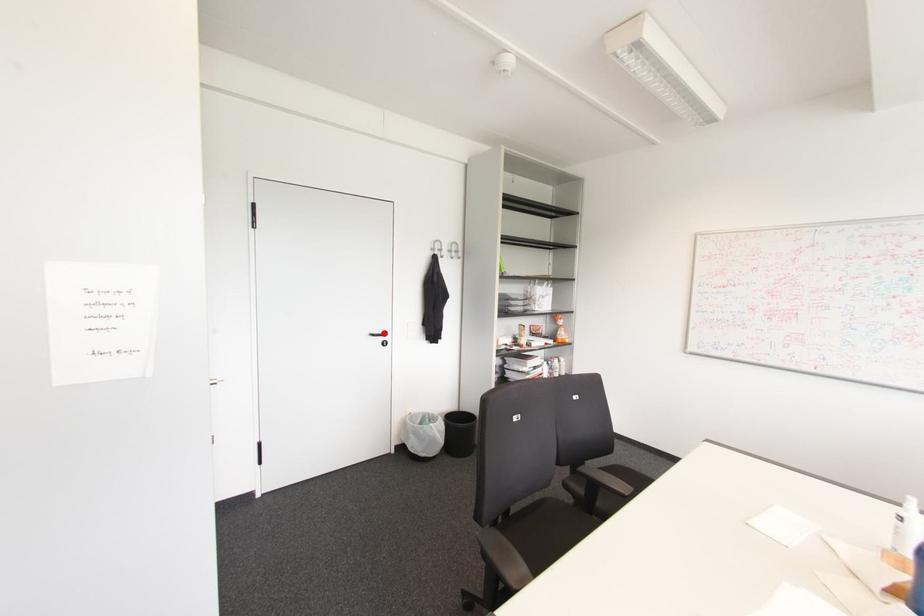
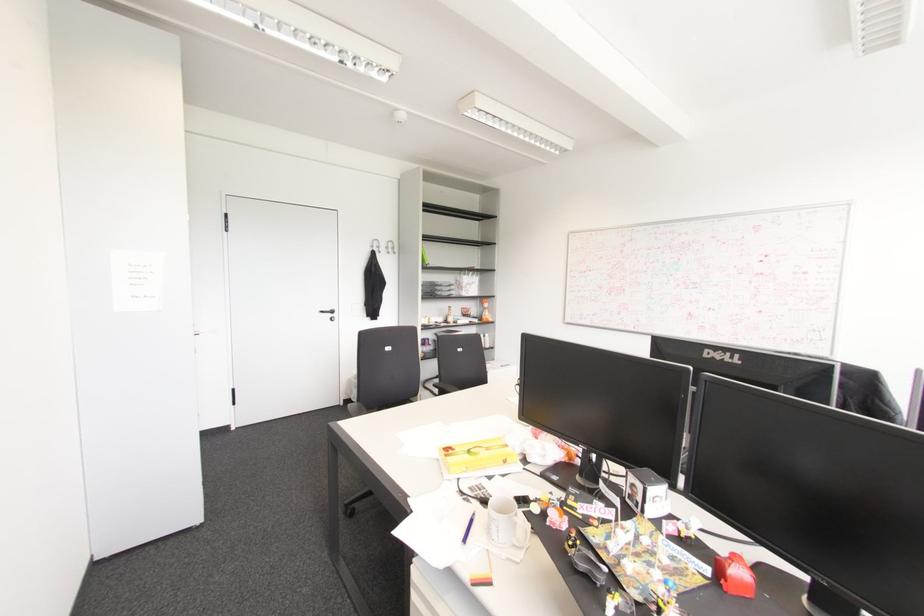
In the second image, find the point that corresponds to the highlighted location in the first image.

(332, 310)